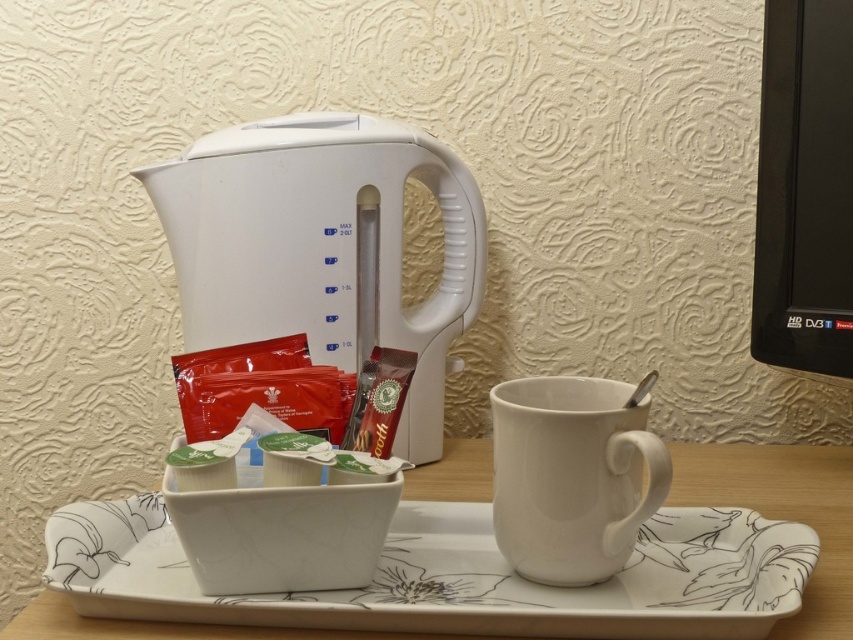
You are setting up a small workstation on the wooden table. You have a white ceramic tray at center and a black plastic monitor at upper right. Which object occupies more horizontal space on the table?

The white ceramic tray at center might be wider than black plastic monitor at upper right, so it likely takes up more horizontal space on the table.

You are preparing to pour hot water into the white ceramic mug at lower center from the white ceramic tray at center. Which direction should you move the tray relative to the mug to avoid spilling?

The white ceramic tray at center is to the left of the white ceramic mug at lower center, so you should move the tray to the right towards the mug to pour without spilling.